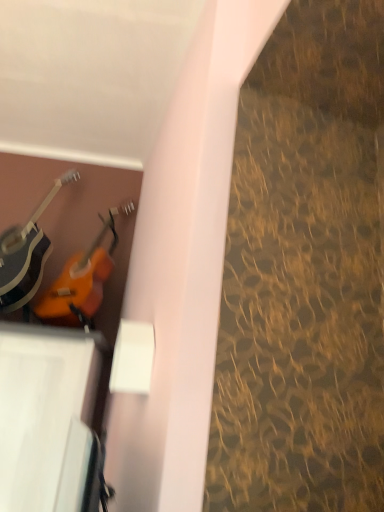
Question: From their relative heights in the image, would you say orange glossy guitar at upper left, which ranks as the 2th guitar in left-to-right order, is taller or shorter than matte black guitar at left, the first guitar in the left-to-right sequence?

Choices:
 (A) tall
 (B) short

Answer: (B)

Question: From the image's perspective, is orange glossy guitar at upper left, which ranks as the 2th guitar in left-to-right order, located above or below matte black guitar at left, the 2th guitar when ordered from right to left?

Choices:
 (A) below
 (B) above

Answer: (A)

Question: Is orange glossy guitar at upper left, placed as the first guitar when sorted from right to left, to the left or to the right of matte black guitar at left, the 2th guitar when ordered from right to left, in the image?

Choices:
 (A) left
 (B) right

Answer: (B)

Question: Considering the positions of point (34, 238) and point (110, 264), is point (34, 238) closer or farther from the camera than point (110, 264)?

Choices:
 (A) farther
 (B) closer

Answer: (A)

Question: Is matte black guitar at left, the 2th guitar when ordered from right to left, wider or thinner than orange glossy guitar at upper left, which ranks as the 2th guitar in left-to-right order?

Choices:
 (A) thin
 (B) wide

Answer: (B)

Question: From a real-world perspective, is matte black guitar at left, the 2th guitar when ordered from right to left, physically located above or below orange glossy guitar at upper left, which ranks as the 2th guitar in left-to-right order?

Choices:
 (A) above
 (B) below

Answer: (A)

Question: Based on their positions, is matte black guitar at left, the first guitar in the left-to-right sequence, located to the left or right of orange glossy guitar at upper left, placed as the first guitar when sorted from right to left?

Choices:
 (A) right
 (B) left

Answer: (B)